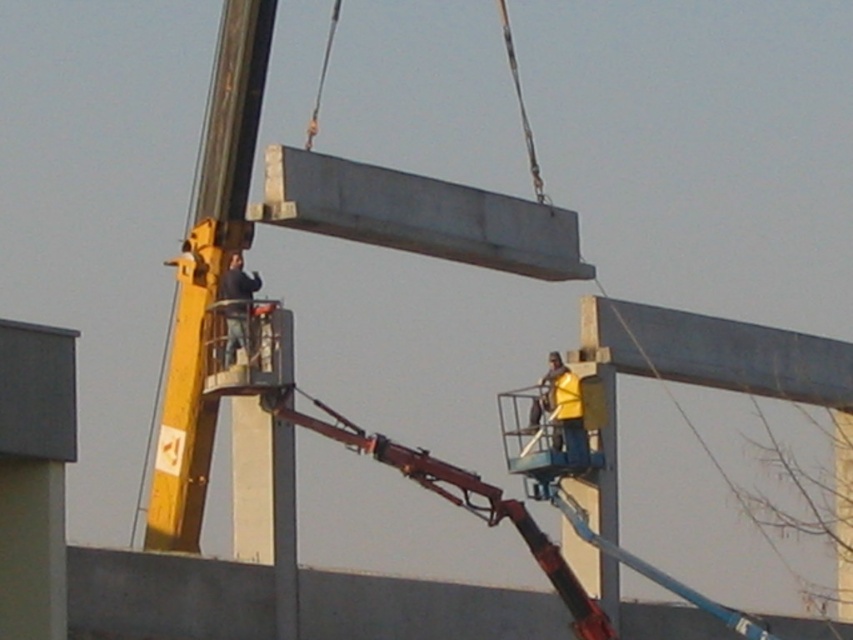
Question: Is metallic gray beam at upper right further to the viewer compared to dark blue jeans at upper center?

Choices:
 (A) no
 (B) yes

Answer: (B)

Question: Is yellow fabric construction worker at center wider than dark blue jeans at upper center?

Choices:
 (A) no
 (B) yes

Answer: (B)

Question: Where is metallic gray beam at upper right located in relation to dark blue jeans at upper center in the image?

Choices:
 (A) right
 (B) left

Answer: (A)

Question: Among these points, which one is farthest from the camera?

Choices:
 (A) (839, 378)
 (B) (228, 266)

Answer: (A)

Question: Which of the following is the closest to the observer?

Choices:
 (A) (235, 333)
 (B) (537, 396)
 (C) (614, 344)

Answer: (A)

Question: Which point is closer to the camera taking this photo?

Choices:
 (A) (233, 289)
 (B) (581, 412)

Answer: (A)